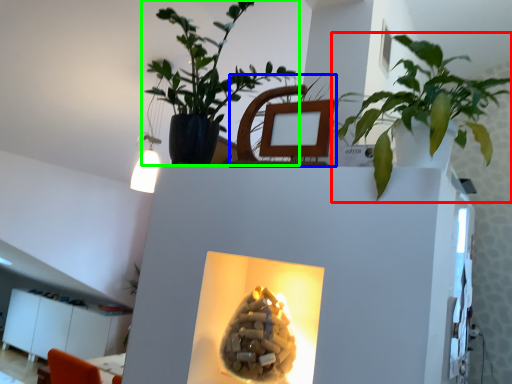
Question: Based on their relative distances, which object is nearer to houseplant (highlighted by a red box)? Choose from swivel chair (highlighted by a blue box) and houseplant (highlighted by a green box).

Choices:
 (A) swivel chair
 (B) houseplant

Answer: (A)